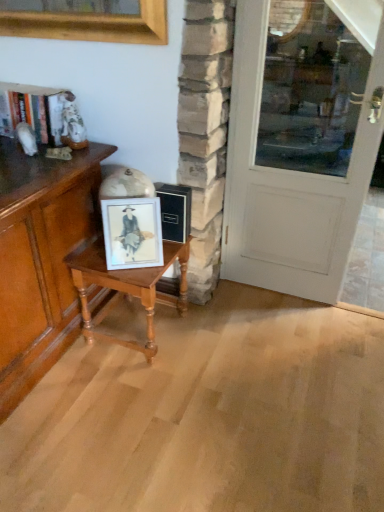
Identify the location of free point to the right of wooden table at center. This screenshot has height=512, width=384. (212, 337).